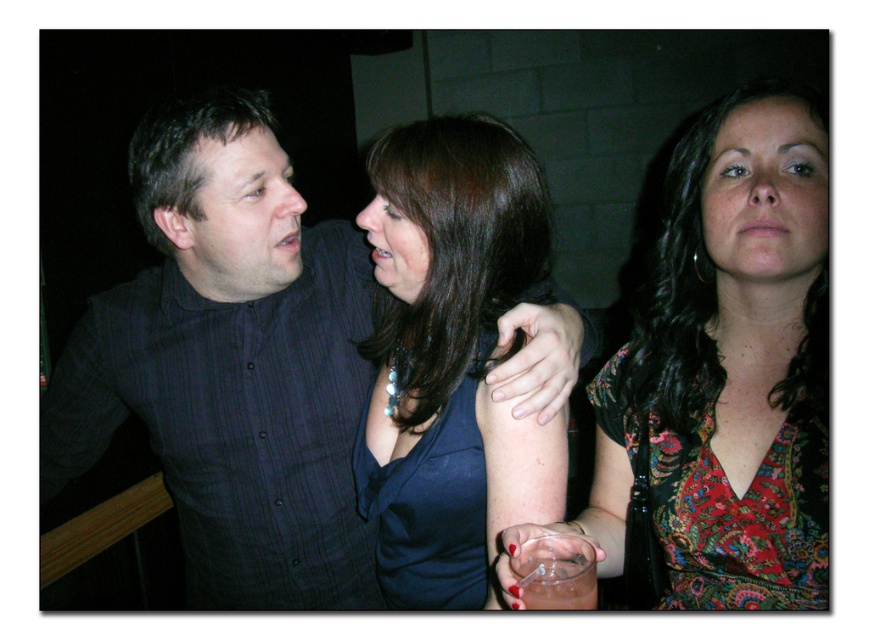
Question: Among these objects, which one is farthest from the camera?

Choices:
 (A) dark blue shirt at center
 (B) shiny blue dress at center
 (C) clear glass at lower center
 (D) floral dress at center

Answer: (A)

Question: Which point is farther to the camera?

Choices:
 (A) (534, 460)
 (B) (523, 604)
 (C) (592, 556)

Answer: (A)

Question: Is floral dress at center behind clear plastic glass at lower center?

Choices:
 (A) yes
 (B) no

Answer: (A)

Question: Is floral dress at center below clear plastic glass at lower center?

Choices:
 (A) no
 (B) yes

Answer: (A)

Question: Can you confirm if floral dress at center is smaller than clear plastic glass at lower center?

Choices:
 (A) yes
 (B) no

Answer: (B)

Question: Estimate the real-world distances between objects in this image. Which object is closer to the clear glass at lower center?

Choices:
 (A) clear plastic glass at lower center
 (B) dark blue shirt at center
 (C) floral dress at center

Answer: (A)